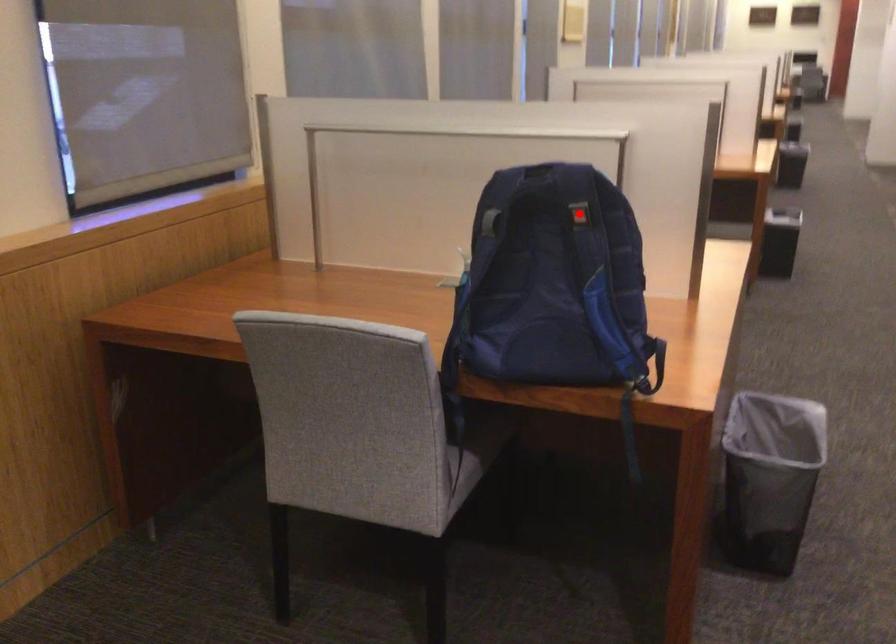
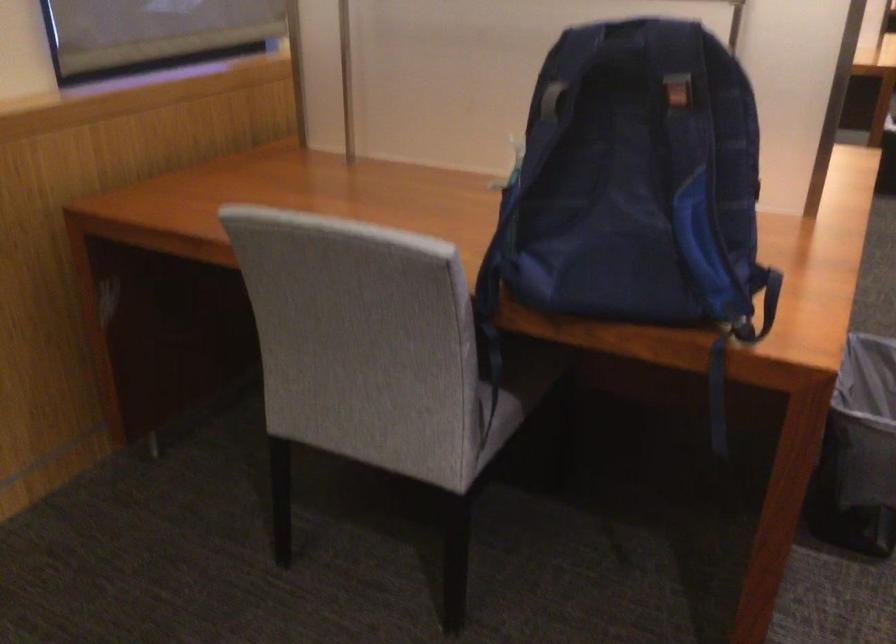
Question: A red point is marked in image1. In image2, is the corresponding 3D point closer to the camera or farther? Reply with the corresponding letter.

Choices:
 (A) The corresponding 3D point is closer.
 (B) The corresponding 3D point is farther.

Answer: (A)